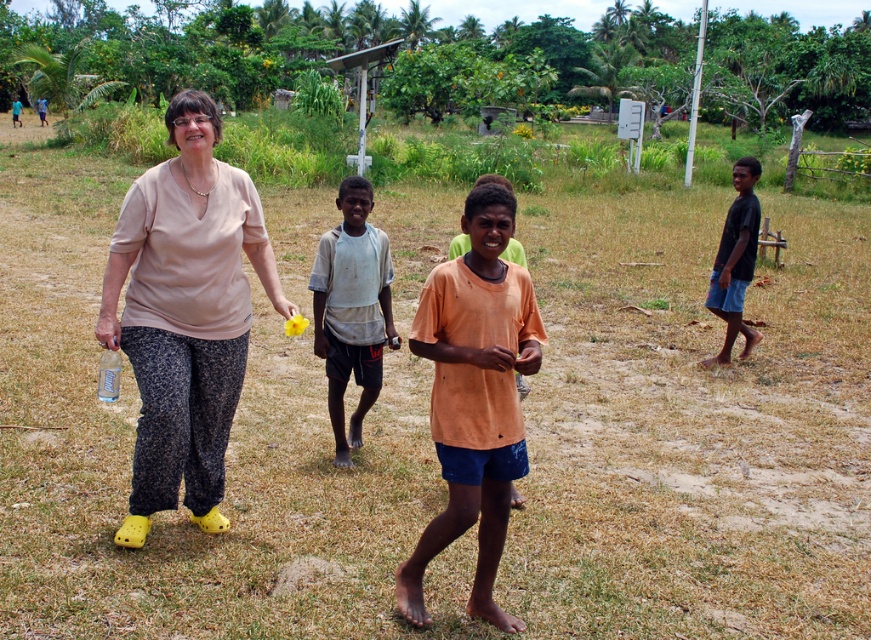
Looking at this image, which is more to the left, orange matte shirt at center or dark blue shorts at right?

From the viewer's perspective, orange matte shirt at center appears more on the left side.

Is point (454, 484) less distant than point (741, 332)?

That is True.

This screenshot has width=871, height=640. What do you see at coordinates (474, 397) in the screenshot? I see `orange matte shirt at center` at bounding box center [474, 397].

Locate an element on the screen. orange matte shirt at center is located at coordinates (474, 397).

Who is taller, white cotton shirt at center or dark blue shorts at right?

dark blue shorts at right is taller.

Which of these two, white cotton shirt at center or dark blue shorts at right, stands shorter?

Standing shorter between the two is white cotton shirt at center.

Identify the location of white cotton shirt at center. (350, 308).

How far apart are orange matte shirt at center and white cotton shirt at center?

orange matte shirt at center and white cotton shirt at center are 1.71 meters apart.

From the picture: Is orange matte shirt at center to the left of white cotton shirt at center from the viewer's perspective?

No, orange matte shirt at center is not to the left of white cotton shirt at center.

Identify the location of orange matte shirt at center. (474, 397).